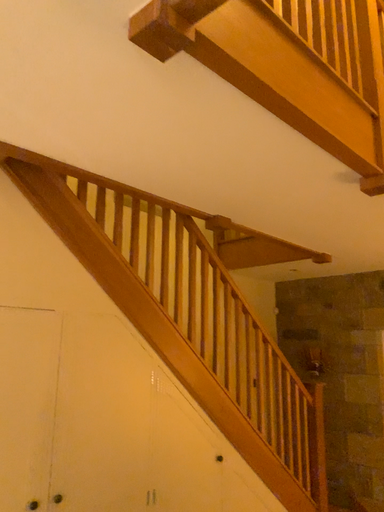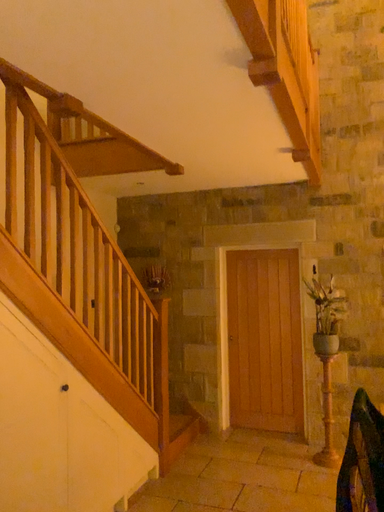
Question: How did the camera likely rotate when shooting the video?

Choices:
 (A) rotated right
 (B) rotated left

Answer: (A)